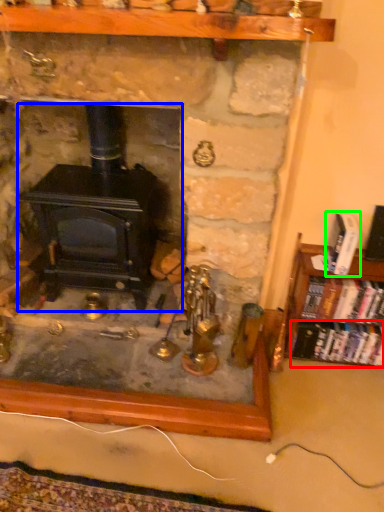
Question: Considering the real-world distances, which object is farthest from book (highlighted by a red box)? wood burning stove (highlighted by a blue box) or book (highlighted by a green box)?

Choices:
 (A) wood burning stove
 (B) book

Answer: (A)